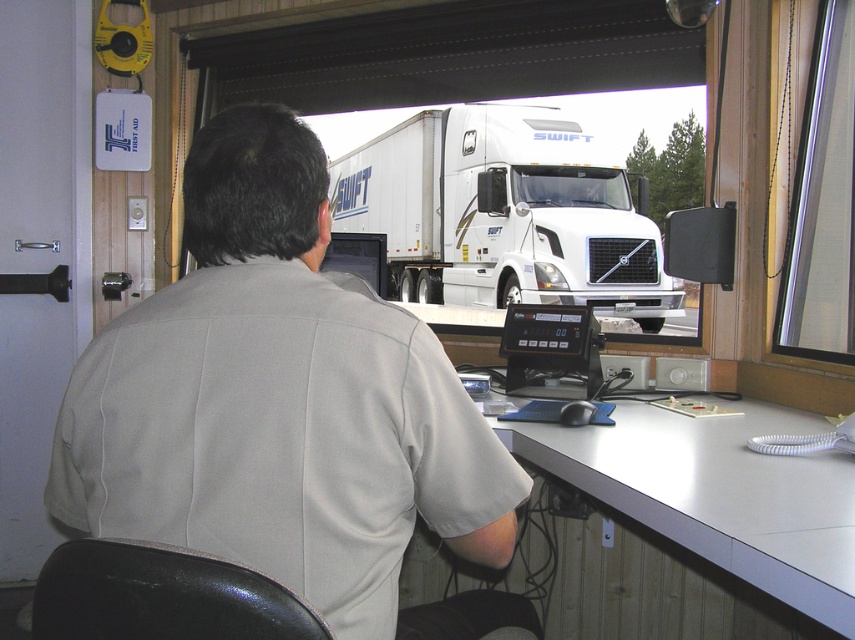
Does white glossy computer desk at lower right appear under white glossy truck driver at center?

Yes, white glossy computer desk at lower right is below white glossy truck driver at center.

Is point (747, 554) behind point (588, 188)?

No, it is in front of (588, 188).

The height and width of the screenshot is (640, 855). Find the location of `white glossy computer desk at lower right`. white glossy computer desk at lower right is located at coordinates (718, 493).

Can you confirm if gray fabric shirt at center is taller than white glossy computer desk at lower right?

Yes.

Is gray fabric shirt at center further to camera compared to white glossy computer desk at lower right?

No, gray fabric shirt at center is in front of white glossy computer desk at lower right.

Is point (342, 476) positioned after point (637, 449)?

No, (342, 476) is in front of (637, 449).

You are a GUI agent. You are given a task and a screenshot of the screen. Output one action in this format:
    pyautogui.click(x=<x>, y=<y>)
    Task: Click on the gray fabric shirt at center
    This screenshot has height=640, width=855.
    Given the screenshot: What is the action you would take?
    pyautogui.click(x=284, y=406)

Is gray fabric shirt at center positioned behind white glossy truck driver at center?

That is False.

Does gray fabric shirt at center have a larger size compared to white glossy truck driver at center?

Indeed, gray fabric shirt at center has a larger size compared to white glossy truck driver at center.

Is point (184, 460) positioned in front of point (608, 204)?

Yes.

Locate an element on the screen. This screenshot has height=640, width=855. gray fabric shirt at center is located at coordinates (284, 406).